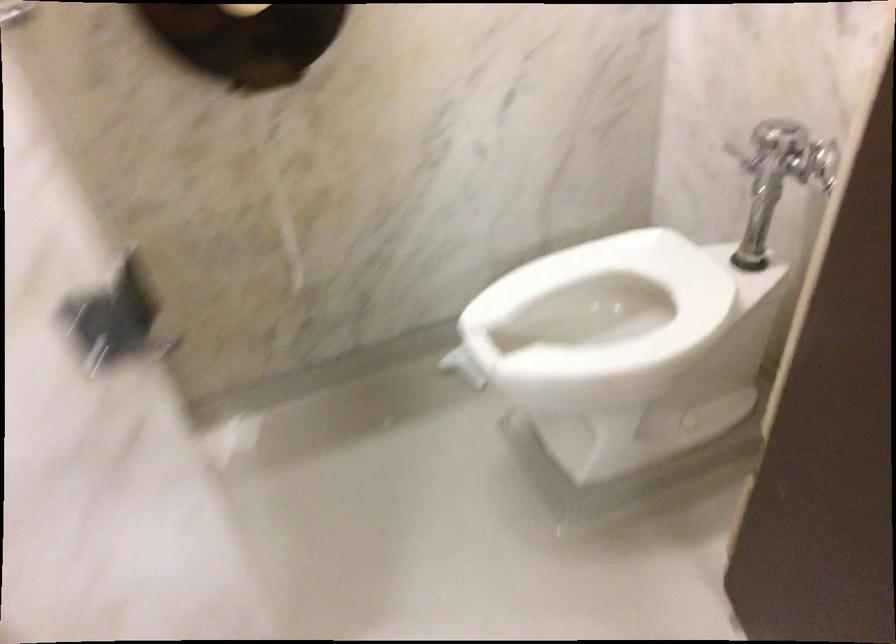
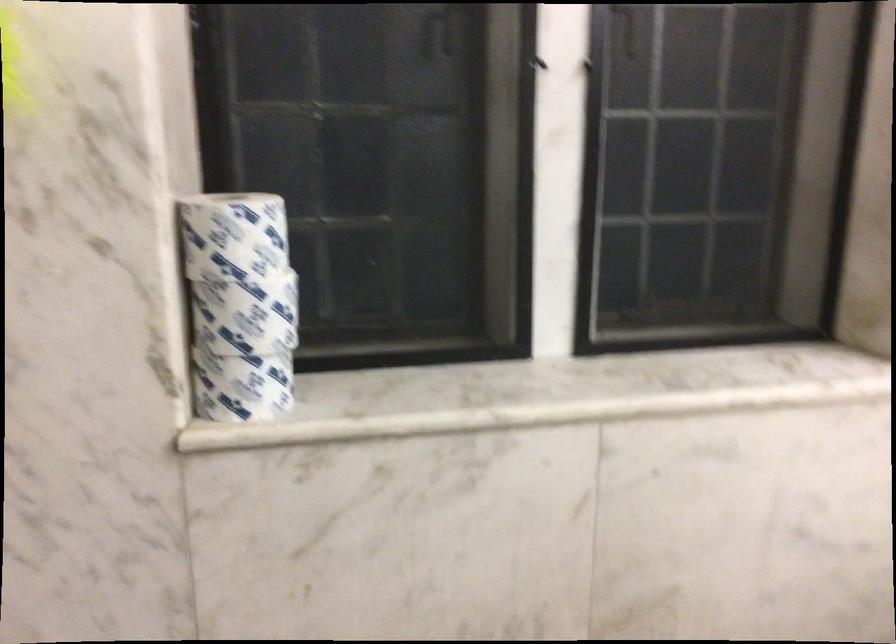
Question: The camera is either moving clockwise (left) or counter-clockwise (right) around the object. The first image is from the beginning of the video and the second image is from the end. Is the camera moving left or right when shooting the video?

Choices:
 (A) Left
 (B) Right

Answer: (A)